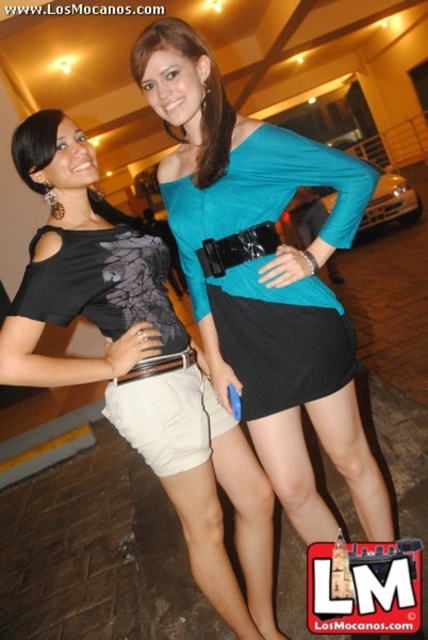
Question: Which object appears closest to the camera in this image?

Choices:
 (A) matte black shorts at lower left
 (B) matte blue top at center

Answer: (A)

Question: Does teal matte jersey dress at center appear over white cotton shorts at center?

Choices:
 (A) no
 (B) yes

Answer: (B)

Question: Is teal matte jersey dress at center below black leather belt at center?

Choices:
 (A) yes
 (B) no

Answer: (B)

Question: Can you confirm if white cotton shorts at center is positioned below black matte belt at center?

Choices:
 (A) no
 (B) yes

Answer: (B)

Question: Which is farther from the white cotton shorts at center?

Choices:
 (A) teal matte jersey dress at center
 (B) black leather belt at center
 (C) matte blue top at center

Answer: (C)

Question: Among these objects, which one is nearest to the camera?

Choices:
 (A) black matte belt at center
 (B) matte black shorts at lower left
 (C) white cotton shorts at center

Answer: (B)